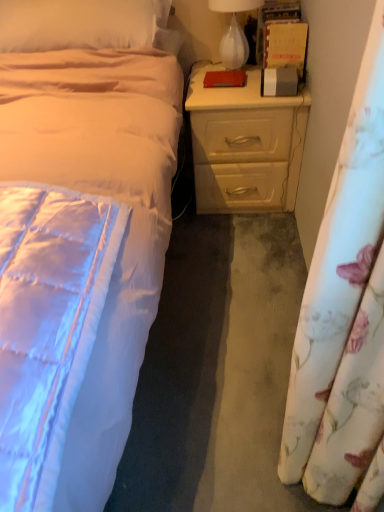
At what (x,y) coordinates should I click in order to perform the action: click on free point above beige wood nightstand at right (from a real-world perspective). Please return your answer as a coordinate pair (x, y). The width and height of the screenshot is (384, 512). Looking at the image, I should click on (228, 88).